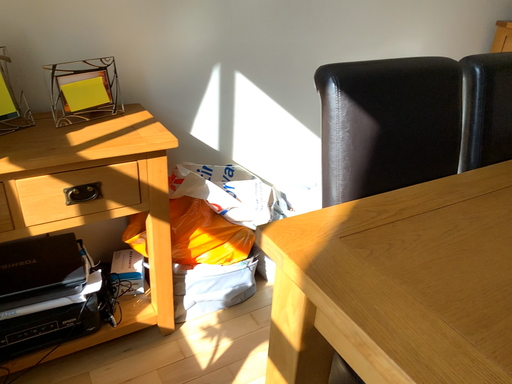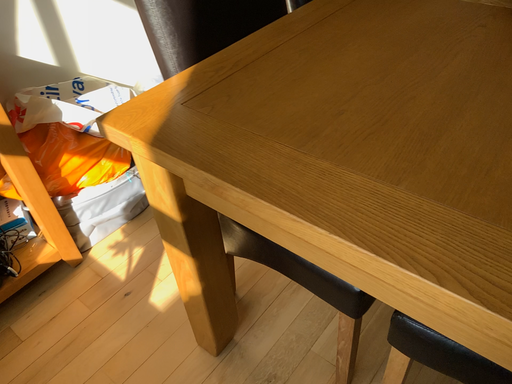
Question: Which way did the camera rotate in the video?

Choices:
 (A) rotated upward
 (B) rotated downward

Answer: (B)